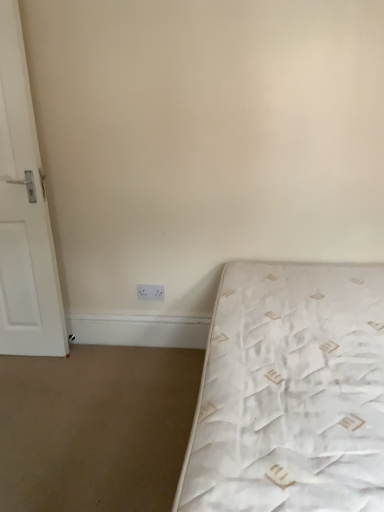
Locate an element on the screen. vacant area that lies in front of white matte door at left is located at coordinates [x=27, y=377].